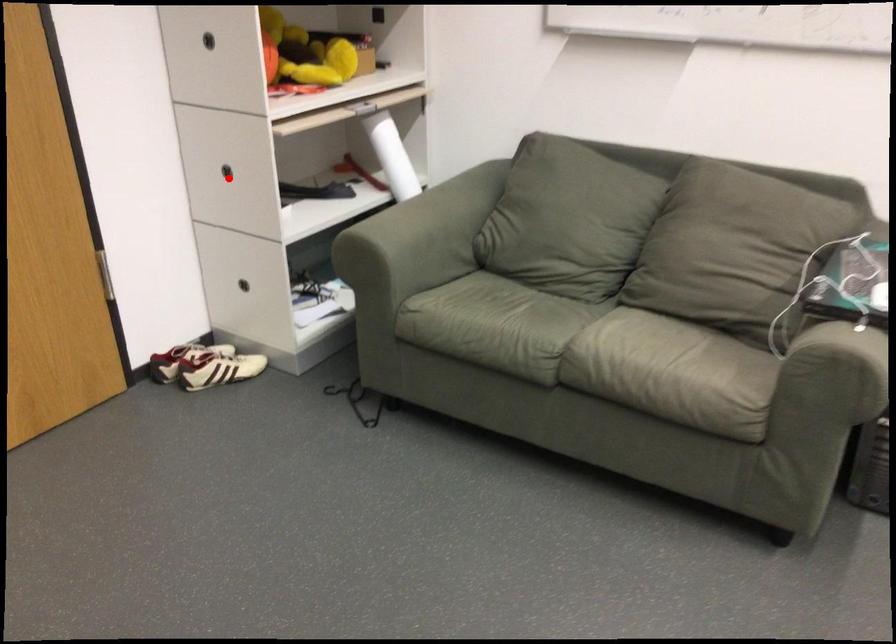
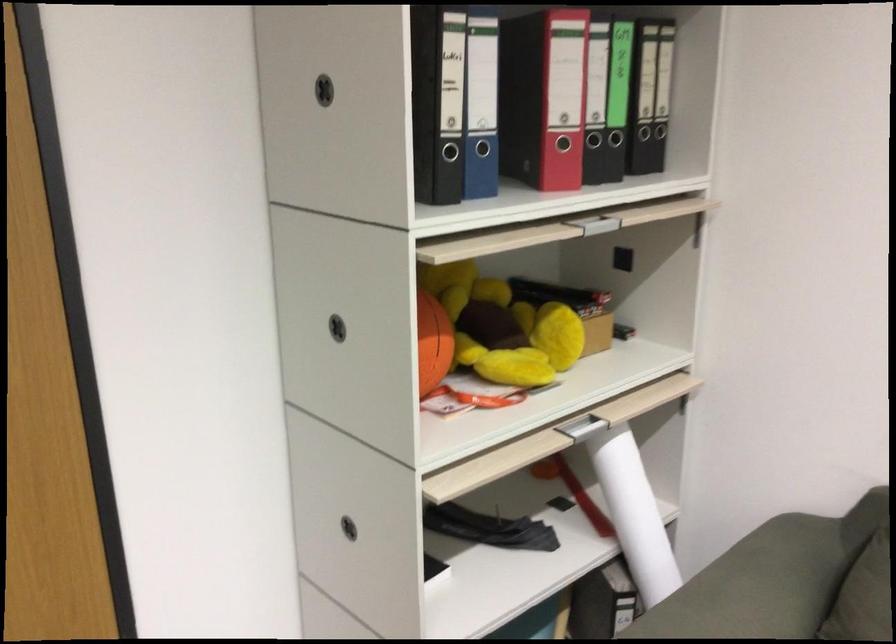
Question: I am providing you with two images of the same scene from different viewpoints. In image1, a red point is highlighted. Considering the same 3D point in image2, which of the following is correct?

Choices:
 (A) It is closer
 (B) It is farther

Answer: (A)